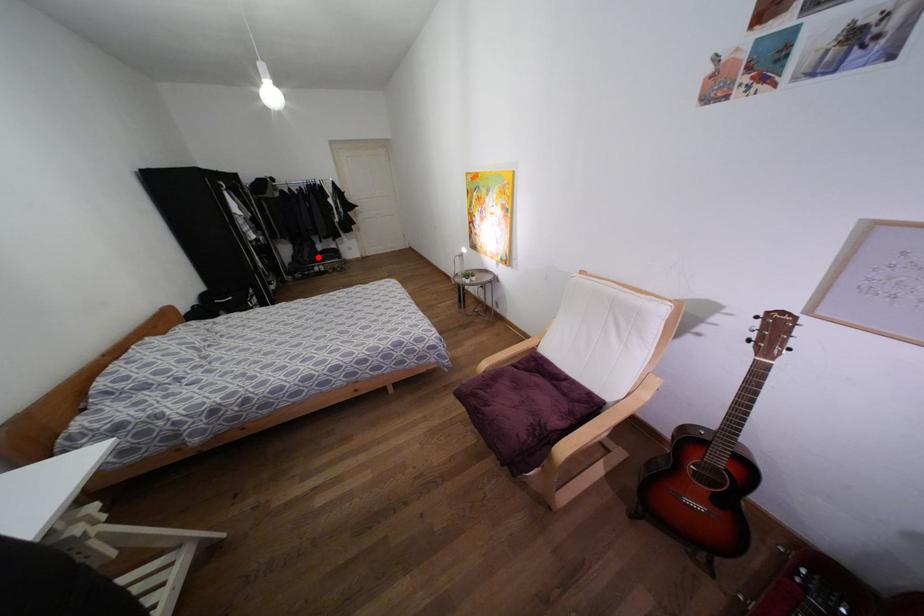
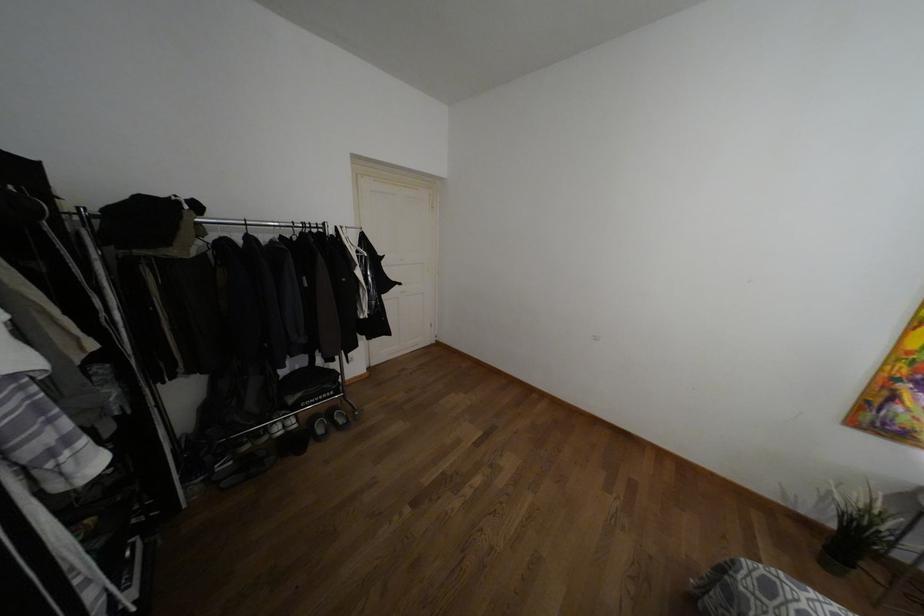
Question: I am providing you with two images of the same scene from different viewpoints. A red point is marked on the first image. At the location where the point appears in image 1, is it still visible in image 2?

Choices:
 (A) Yes
 (B) No

Answer: (A)